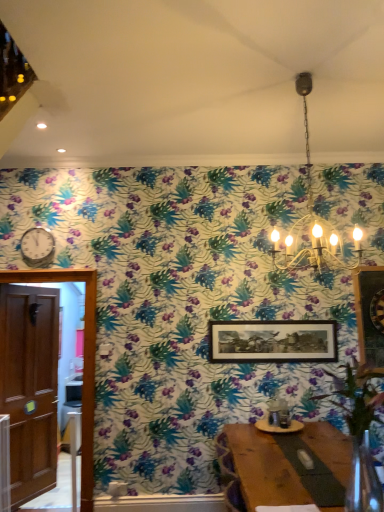
Question: Is metallic silver clock at left bigger than wooden door at left?

Choices:
 (A) yes
 (B) no

Answer: (B)

Question: From a real-world perspective, does metallic silver clock at left stand above wooden door at left?

Choices:
 (A) yes
 (B) no

Answer: (A)

Question: Are metallic silver clock at left and wooden door at left making contact?

Choices:
 (A) no
 (B) yes

Answer: (A)

Question: From a real-world perspective, is metallic silver clock at left positioned under wooden door at left based on gravity?

Choices:
 (A) yes
 (B) no

Answer: (B)

Question: Is metallic silver clock at left smaller than wooden door at left?

Choices:
 (A) no
 (B) yes

Answer: (B)

Question: Which is correct: wooden door at left is inside metallic chandelier at upper center, or outside of it?

Choices:
 (A) inside
 (B) outside

Answer: (B)

Question: In the image, is wooden door at left on the left side or the right side of metallic chandelier at upper center?

Choices:
 (A) left
 (B) right

Answer: (A)

Question: From a real-world perspective, is wooden door at left above or below metallic chandelier at upper center?

Choices:
 (A) below
 (B) above

Answer: (A)

Question: In terms of height, does wooden door at left look taller or shorter compared to metallic chandelier at upper center?

Choices:
 (A) tall
 (B) short

Answer: (A)

Question: From the image's perspective, relative to wooden framed picture at center, is wooden door at left above or below?

Choices:
 (A) above
 (B) below

Answer: (B)

Question: Visually, is wooden door at left positioned to the left or to the right of wooden framed picture at center?

Choices:
 (A) right
 (B) left

Answer: (B)

Question: Considering the positions of wooden door at left and wooden framed picture at center in the image, is wooden door at left taller or shorter than wooden framed picture at center?

Choices:
 (A) tall
 (B) short

Answer: (A)

Question: In terms of width, does wooden door at left look wider or thinner when compared to wooden framed picture at center?

Choices:
 (A) wide
 (B) thin

Answer: (A)

Question: Do you think metallic chandelier at upper center is within metallic silver clock at left, or outside of it?

Choices:
 (A) outside
 (B) inside

Answer: (A)

Question: Would you say metallic chandelier at upper center is to the left or to the right of metallic silver clock at left in the picture?

Choices:
 (A) right
 (B) left

Answer: (A)